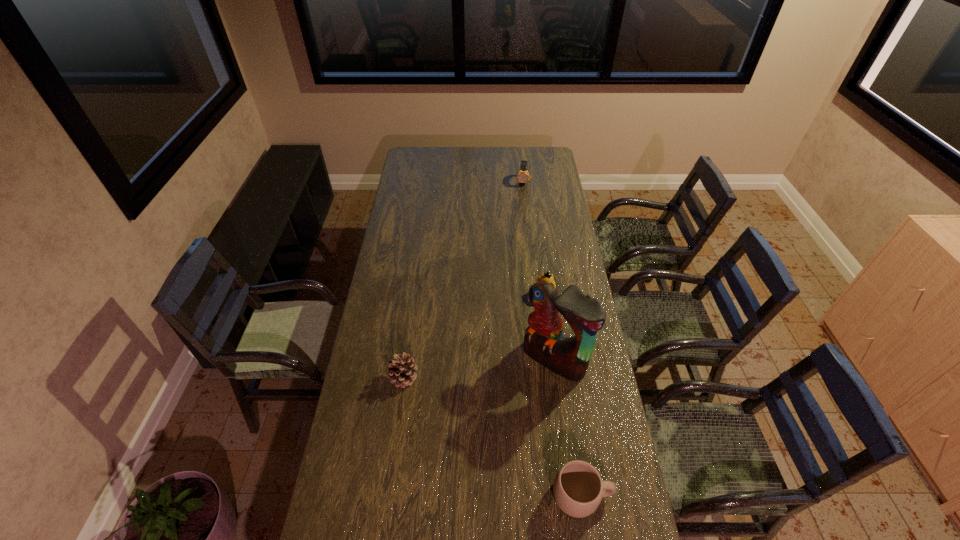
Where is `free space between the second farthest object and the nearest object`? The image size is (960, 540). free space between the second farthest object and the nearest object is located at coordinates (564, 394).

Find the location of `free space between the nearest object and the pinecone`. free space between the nearest object and the pinecone is located at coordinates (492, 436).

The height and width of the screenshot is (540, 960). Find the location of `free spot between the tallest object and the leftmost object`. free spot between the tallest object and the leftmost object is located at coordinates (479, 368).

What are the coordinates of `free space between the nearest object and the pinecone` in the screenshot? It's located at (492, 436).

I want to click on vacant space that is in between the leftmost object and the fourth nearest object, so click(x=474, y=335).

You are a GUI agent. You are given a task and a screenshot of the screen. Output one action in this format:
    pyautogui.click(x=<x>, y=<y>)
    Task: Click on the unoccupied position between the mug and the fourth nearest object
    The width and height of the screenshot is (960, 540).
    Given the screenshot: What is the action you would take?
    coord(564,394)

Where is `object that is the third nearest to the pinecone`? object that is the third nearest to the pinecone is located at coordinates (546, 277).

Identify which object is the second nearest to the nearest object. Please provide its 2D coordinates. Your answer should be formatted as a tuple, i.e. [(x, y)], where the tuple contains the x and y coordinates of a point satisfying the conditions above.

[(401, 370)]

I want to click on vacant space that satisfies the following two spatial constraints: 1. on the back side of the leftmost object; 2. on the left side of the parrot, so click(x=406, y=360).

In order to click on free space that satisfies the following two spatial constraints: 1. on the front side of the nearest object; 2. on the side of the pinecone with the handle in this screenshot , I will do `click(388, 495)`.